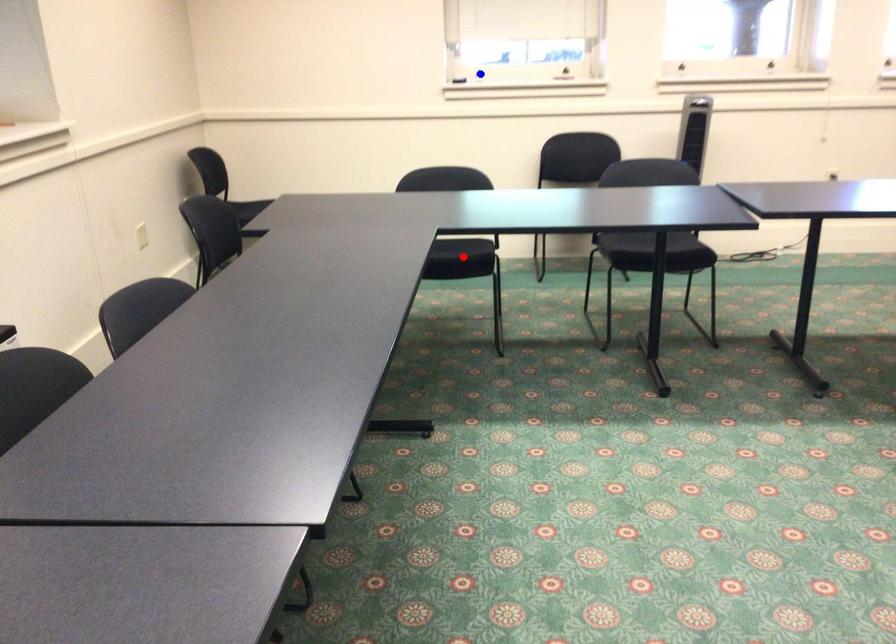
Question: In the image, two points are highlighted. Which point is nearer to the camera? Reply with the corresponding letter.

Choices:
 (A) blue point
 (B) red point

Answer: (B)